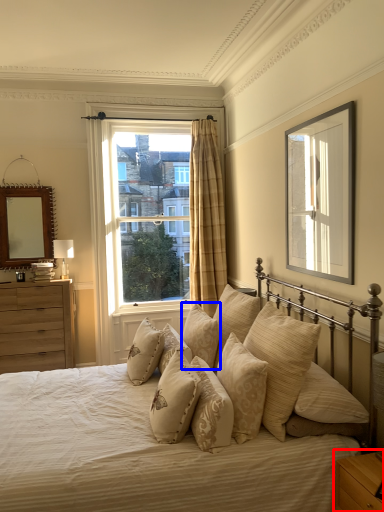
Question: Which point is closer to the camera, nightstand (highlighted by a red box) or pillow (highlighted by a blue box)?

Choices:
 (A) nightstand
 (B) pillow

Answer: (A)